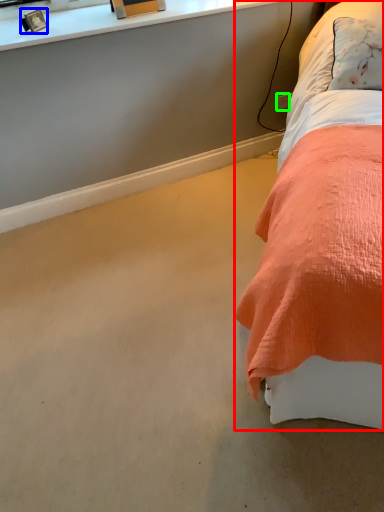
Question: Based on their relative distances, which object is nearer to bed (highlighted by a red box)? Choose from picture frame (highlighted by a blue box) and power outlet (highlighted by a green box).

Choices:
 (A) picture frame
 (B) power outlet

Answer: (B)